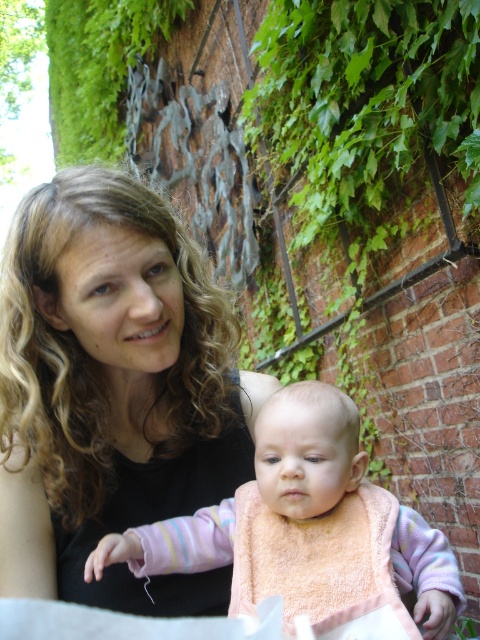
Is black matte hair at upper left to the left of pink terry cloth bib at center from the viewer's perspective?

Indeed, black matte hair at upper left is positioned on the left side of pink terry cloth bib at center.

Does point (108, 406) come closer to viewer compared to point (344, 464)?

No.

The height and width of the screenshot is (640, 480). What do you see at coordinates (112, 390) in the screenshot?
I see `black matte hair at upper left` at bounding box center [112, 390].

You are a GUI agent. You are given a task and a screenshot of the screen. Output one action in this format:
    pyautogui.click(x=<x>, y=<y>)
    Task: Click on the black matte hair at upper left
    Image resolution: width=480 pixels, height=640 pixels.
    Given the screenshot: What is the action you would take?
    pyautogui.click(x=112, y=390)